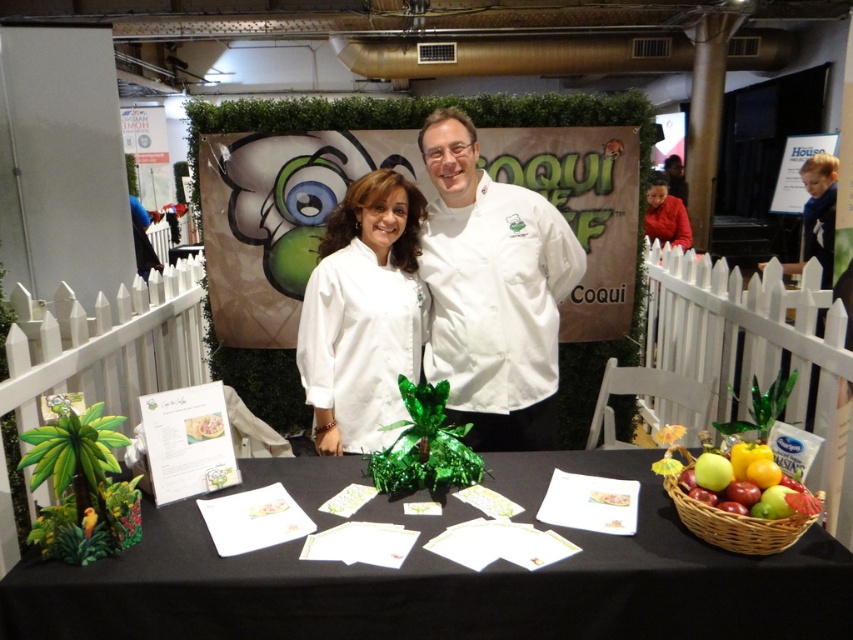
Question: Among these points, which one is farthest from the camera?

Choices:
 (A) (712, 460)
 (B) (775, 547)
 (C) (457, 580)
 (D) (323, 388)

Answer: (D)

Question: Observing the image, what is the correct spatial positioning of black fabric table at center in reference to green matte apple at center?

Choices:
 (A) below
 (B) above

Answer: (A)

Question: Is black fabric table at center above woven brown basket at lower right?

Choices:
 (A) yes
 (B) no

Answer: (B)

Question: Is black fabric table at center above white glossy chef coat at center?

Choices:
 (A) no
 (B) yes

Answer: (A)

Question: Which of the following is the farthest from the observer?

Choices:
 (A) (434, 109)
 (B) (585, 461)

Answer: (A)

Question: Among these objects, which one is farthest from the camera?

Choices:
 (A) black fabric table at center
 (B) white matte chef coat at center
 (C) green matte apple at center

Answer: (B)